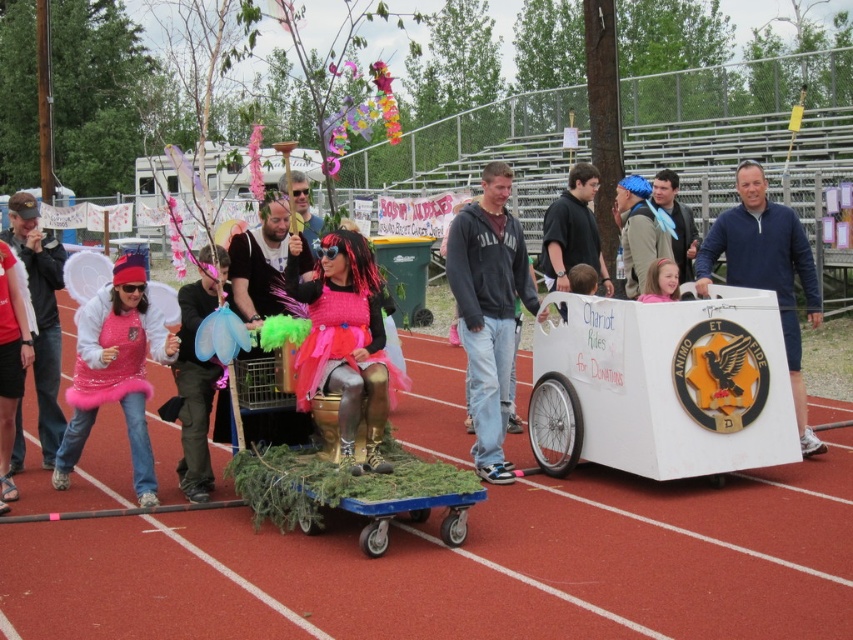
Who is positioned more to the left, pink glittery dress at center or brushed metal wings at center?

From the viewer's perspective, brushed metal wings at center appears more on the left side.

Is point (306, 381) closer to camera compared to point (200, 396)?

Yes, it is.

What do you see at coordinates (344, 342) in the screenshot? The height and width of the screenshot is (640, 853). I see `pink glittery dress at center` at bounding box center [344, 342].

The image size is (853, 640). Find the location of `pink glittery dress at center`. pink glittery dress at center is located at coordinates (344, 342).

Which is in front, point (624, 493) or point (22, 221)?

Point (624, 493)

Which is more to the left, red rubber race track at center or pink glittery wings at left?

Positioned to the left is pink glittery wings at left.

Does point (840, 588) come behind point (45, 301)?

No.

Where is `red rubber race track at center`? This screenshot has height=640, width=853. red rubber race track at center is located at coordinates (469, 566).

Is pink feather vest at left above blue fleece jacket at right?

No.

Which is more to the left, pink feather vest at left or blue fleece jacket at right?

From the viewer's perspective, pink feather vest at left appears more on the left side.

Does point (149, 477) come in front of point (750, 237)?

That is True.

Identify the location of pink feather vest at left. The image size is (853, 640). (115, 371).